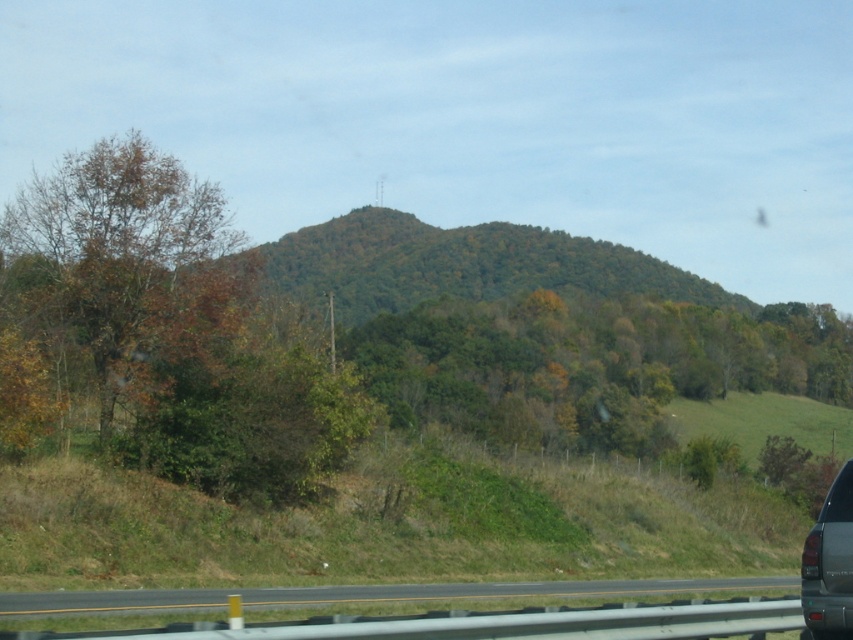
You are a driver who just passed a brown leafy tree at left and now approaching the black asphalt road at lower center. Which object will appear larger in your rearview mirror as you drive forward?

The brown leafy tree at left will appear larger in your rearview mirror because it is bigger than the black asphalt road at lower center.

You are a pedestrian standing on the black asphalt road at lower center. You want to reach the brown leafy tree at left. Is the tree located above the road you are standing on?

The brown leafy tree at left is positioned over the black asphalt road at lower center, so yes, the tree is located above the road you are standing on.

You are a passenger in a car traveling along the road shown in the image. You notice the black asphalt road at lower center. Based on its position in the scene, where would you estimate the road is located relative to your current viewpoint?

The black asphalt road at lower center is located at point coordinates approximately 0.930 on the x axis and 0.427 on the y axis relative to the current viewpoint.